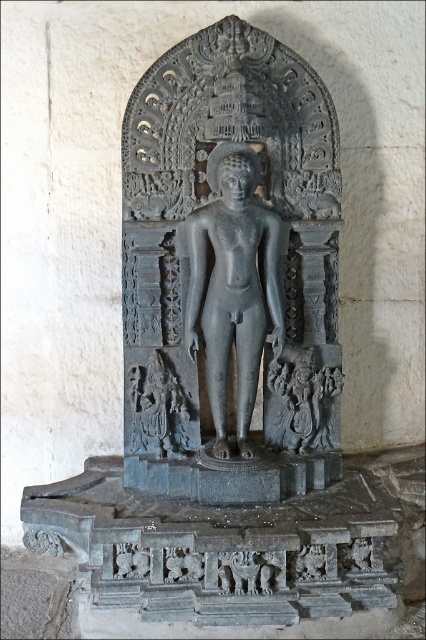
Does point (160, 296) come closer to viewer compared to point (210, 173)?

No, (160, 296) is behind (210, 173).

Between black stone statue at center and gray stone statue at center, which one is positioned lower?

gray stone statue at center

Who is more forward, (158, 476) or (215, 384)?

Point (215, 384) is more forward.

You are a GUI agent. You are given a task and a screenshot of the screen. Output one action in this format:
    pyautogui.click(x=<x>, y=<y>)
    Task: Click on the black stone statue at center
    The image size is (426, 640).
    Given the screenshot: What is the action you would take?
    pyautogui.click(x=230, y=269)

Who is positioned more to the right, black stone statue at center or dark gray stone carving at lower left?

Answer: black stone statue at center

Is black stone statue at center to the right of dark gray stone carving at lower left from the viewer's perspective?

Correct, you'll find black stone statue at center to the right of dark gray stone carving at lower left.

What do you see at coordinates (230, 269) in the screenshot? I see `black stone statue at center` at bounding box center [230, 269].

Where is `black stone statue at center`? black stone statue at center is located at coordinates (230, 269).

Does gray stone statue at center appear over dark gray stone carving at lower left?

Indeed, gray stone statue at center is positioned over dark gray stone carving at lower left.

Is gray stone statue at center wider than dark gray stone carving at lower left?

Yes.

The height and width of the screenshot is (640, 426). Identify the location of gray stone statue at center. (233, 285).

At what (x,y) coordinates should I click in order to perform the action: click on gray stone statue at center. Please return your answer as a coordinate pair (x, y). Looking at the image, I should click on (233, 285).